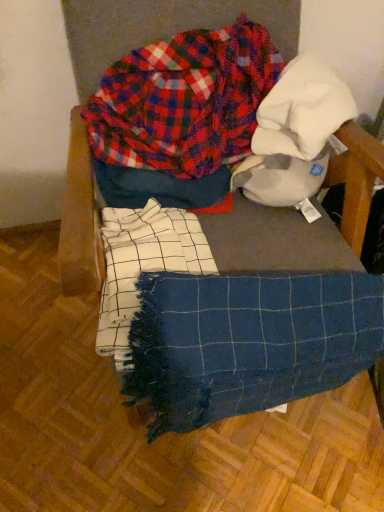
What do you see at coordinates (247, 342) in the screenshot?
I see `blue woven blanket at center` at bounding box center [247, 342].

Identify the location of blue woven blanket at center. The width and height of the screenshot is (384, 512). (80, 219).

Identify the location of blue woven blanket at center. The height and width of the screenshot is (512, 384). (247, 342).

You are a GUI agent. You are given a task and a screenshot of the screen. Output one action in this format:
    pyautogui.click(x=<x>, y=<y>)
    Task: Click on the flannel that is on the left side of blue woven blanket at center
    This screenshot has height=512, width=384.
    Given the screenshot: What is the action you would take?
    pyautogui.click(x=184, y=101)

Does plaid fabric at upper center have a lesser width compared to blue woven blanket at center?

Indeed, plaid fabric at upper center has a lesser width compared to blue woven blanket at center.

Does point (162, 142) appear closer or farther from the camera than point (75, 156)?

Point (162, 142) is farther from the camera than point (75, 156).

From the image's perspective, is blue woven blanket at center below blue woven blanket at center?

Actually, blue woven blanket at center appears above blue woven blanket at center in the image.

Which object is wider, blue woven blanket at center or blue woven blanket at center?

Wider between the two is blue woven blanket at center.

Is point (66, 254) less distant than point (359, 336)?

Yes, it is.

Which is correct: blue woven blanket at center is inside blue woven blanket at center, or outside of it?

blue woven blanket at center is outside blue woven blanket at center.

Does plaid fabric at upper center have a smaller size compared to blue woven blanket at center?

Yes.

Does plaid fabric at upper center turn towards blue woven blanket at center?

Yes.

Would you say blue woven blanket at center is outside plaid fabric at upper center?

Yes, blue woven blanket at center is outside of plaid fabric at upper center.

Does blue woven blanket at center have a larger size compared to plaid fabric at upper center?

Indeed, blue woven blanket at center has a larger size compared to plaid fabric at upper center.

Is blue woven blanket at center far away from plaid fabric at upper center?

No, blue woven blanket at center is not far from plaid fabric at upper center.

Which of these two, blue woven blanket at center or blue woven blanket at center, is thinner?

blue woven blanket at center is thinner.

Is blue woven blanket at center oriented towards blue woven blanket at center?

No, blue woven blanket at center is not facing towards blue woven blanket at center.

Which is more distant, (193, 311) or (73, 280)?

Positioned behind is point (193, 311).

The width and height of the screenshot is (384, 512). I want to click on furniture below the plaid fabric at upper center (from a real-world perspective), so [80, 219].

Is blue woven blanket at center positioned with its back to plaid fabric at upper center?

Yes, blue woven blanket at center is facing away from plaid fabric at upper center.

From their relative heights in the image, would you say blue woven blanket at center is taller or shorter than plaid fabric at upper center?

In the image, blue woven blanket at center appears to be taller than plaid fabric at upper center.

Can you tell me how much blue woven blanket at center and plaid fabric at upper center differ in facing direction?

There is a 4.07-degree angle between the facing directions of blue woven blanket at center and plaid fabric at upper center.

Where is `furniture below the plaid fabric at upper center (from the image's perspective)`? The image size is (384, 512). furniture below the plaid fabric at upper center (from the image's perspective) is located at coordinates (80, 219).

Locate an element on the screen. This screenshot has height=512, width=384. furniture above the blue woven blanket at center (from the image's perspective) is located at coordinates (80, 219).

When comparing their distances from blue woven blanket at center, does plaid fabric at upper center or blue woven blanket at center seem further?

plaid fabric at upper center is positioned further to the anchor blue woven blanket at center.

Which object lies nearer to the anchor point plaid fabric at upper center, blue woven blanket at center or blue woven blanket at center?

The object closer to plaid fabric at upper center is blue woven blanket at center.

Considering their positions, is blue woven blanket at center positioned further to blue woven blanket at center than plaid fabric at upper center?

plaid fabric at upper center is positioned further to the anchor blue woven blanket at center.

Estimate the real-world distances between objects in this image. Which object is further from blue woven blanket at center, plaid fabric at upper center or blue woven blanket at center?

blue woven blanket at center.

When comparing their distances from plaid fabric at upper center, does blue woven blanket at center or blue woven blanket at center seem closer?

Based on the image, blue woven blanket at center appears to be nearer to plaid fabric at upper center.

Which object lies further to the anchor point blue woven blanket at center, blue woven blanket at center or plaid fabric at upper center?

blue woven blanket at center is positioned further to the anchor blue woven blanket at center.

Locate an element on the screen. Image resolution: width=384 pixels, height=512 pixels. furniture between plaid fabric at upper center and blue woven blanket at center vertically is located at coordinates (80, 219).